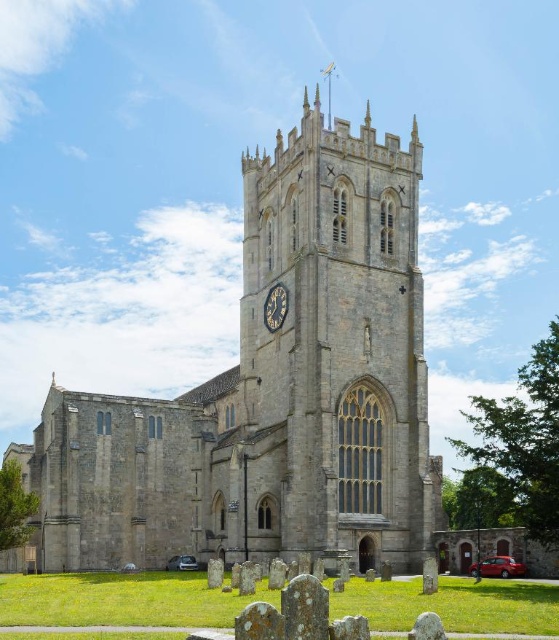
Question: Does stone clock tower at center have a greater width compared to dark blue stone clock at center?

Choices:
 (A) yes
 (B) no

Answer: (A)

Question: Which of the following is the farthest from the observer?

Choices:
 (A) dark blue stone clock at center
 (B) gray stone church at center
 (C) stone clock tower at center

Answer: (A)

Question: Is stone clock tower at center wider than dark blue stone clock at center?

Choices:
 (A) yes
 (B) no

Answer: (A)

Question: Is gray stone church at center wider than stone clock tower at center?

Choices:
 (A) no
 (B) yes

Answer: (B)

Question: Which point is closer to the camera?

Choices:
 (A) gray stone church at center
 (B) stone clock tower at center
 (C) dark blue stone clock at center

Answer: (A)

Question: Which object appears farthest from the camera in this image?

Choices:
 (A) gray stone church at center
 (B) stone clock tower at center
 (C) dark blue stone clock at center

Answer: (C)